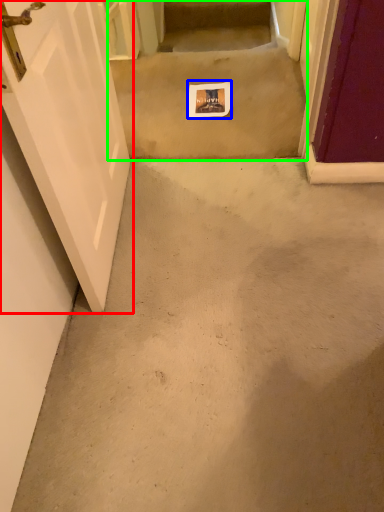
Question: Estimate the real-world distances between objects in this image. Which object is closer to door (highlighted by a red box), postcard (highlighted by a blue box) or stairwell (highlighted by a green box)?

Choices:
 (A) postcard
 (B) stairwell

Answer: (B)